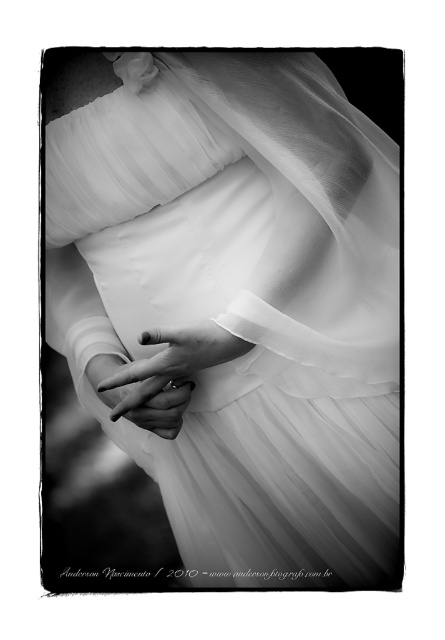
Question: Which point is farther to the camera?

Choices:
 (A) smooth white hands at center
 (B) translucent white dress at center

Answer: (A)

Question: Which object appears farthest from the camera in this image?

Choices:
 (A) smooth white hands at center
 (B) translucent white dress at center

Answer: (A)

Question: Is translucent white dress at center behind smooth white hands at center?

Choices:
 (A) no
 (B) yes

Answer: (A)

Question: Is translucent white dress at center smaller than smooth white hands at center?

Choices:
 (A) no
 (B) yes

Answer: (A)

Question: Does translucent white dress at center appear on the right side of smooth white hands at center?

Choices:
 (A) yes
 (B) no

Answer: (A)